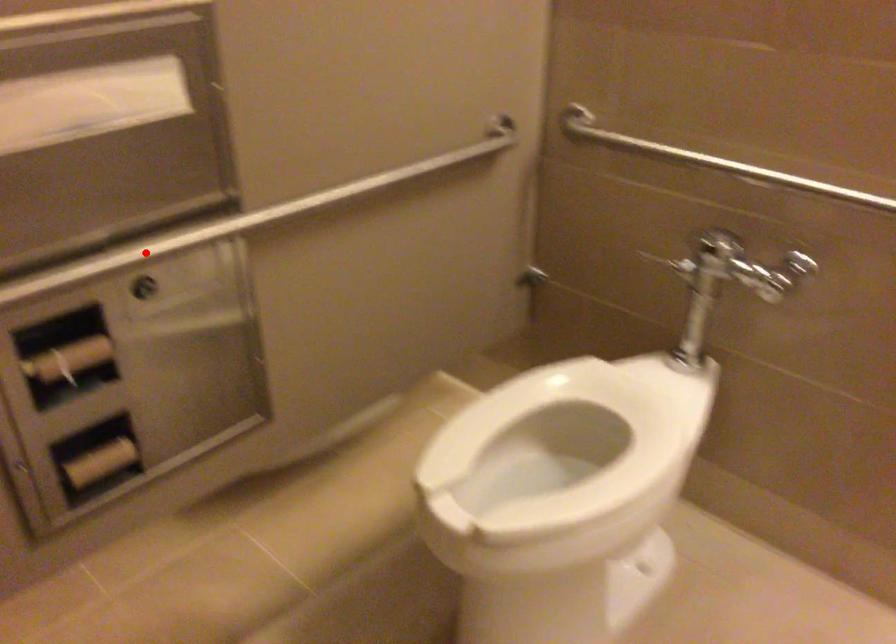
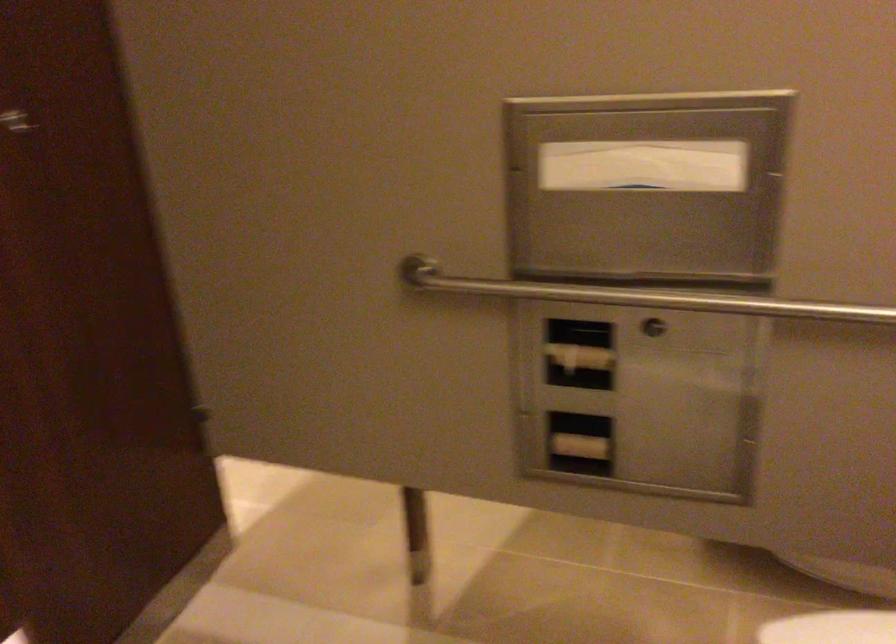
Locate, in the second image, the point that corresponds to the highlighted location in the first image.

(639, 296)